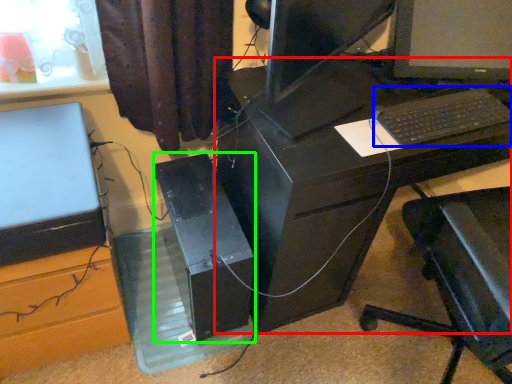
Question: Based on their relative distances, which object is nearer to desk (highlighted by a red box)? Choose from computer keyboard (highlighted by a blue box) and computer tower (highlighted by a green box).

Choices:
 (A) computer keyboard
 (B) computer tower

Answer: (B)